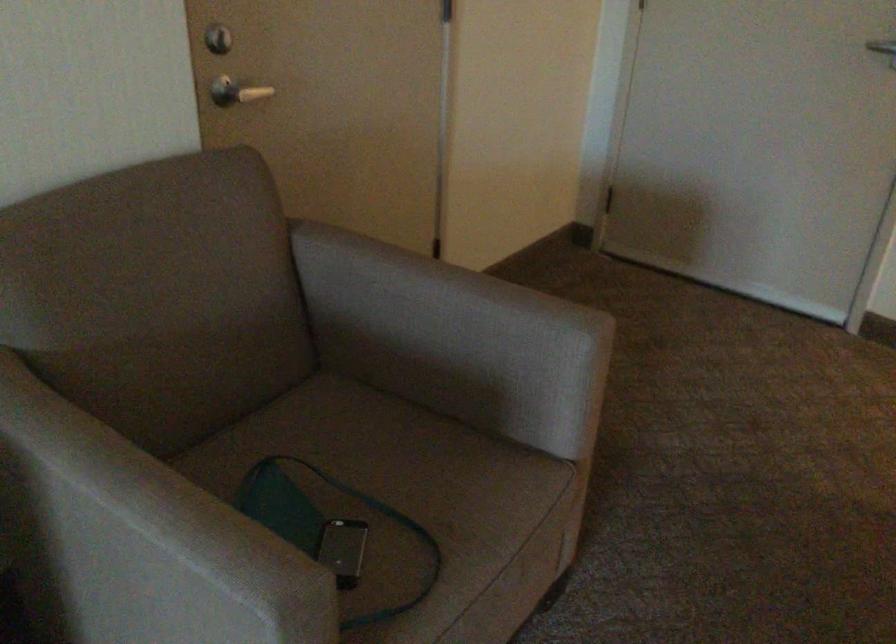
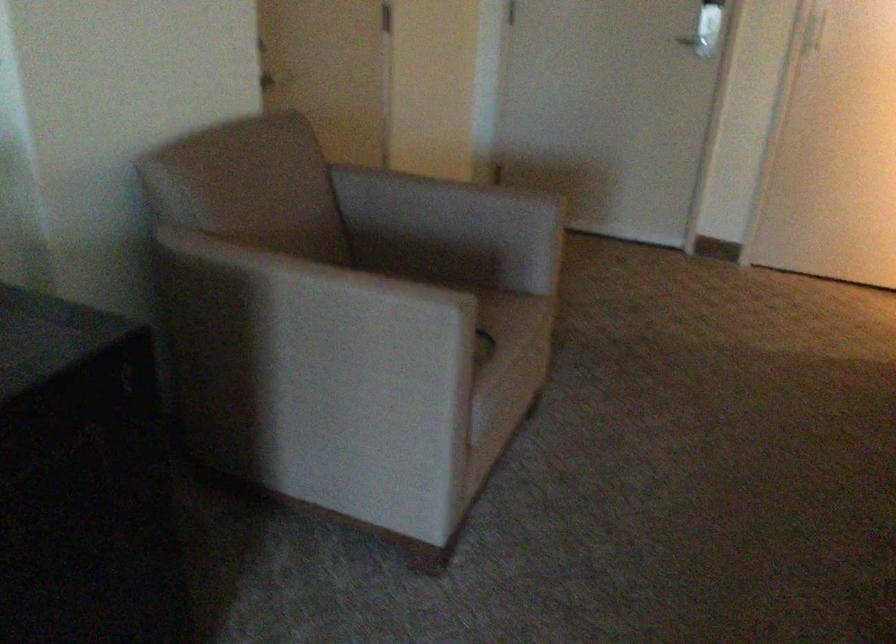
Question: The camera is either moving clockwise (left) or counter-clockwise (right) around the object. The first image is from the beginning of the video and the second image is from the end. Is the camera moving left or right when shooting the video?

Choices:
 (A) Left
 (B) Right

Answer: (A)